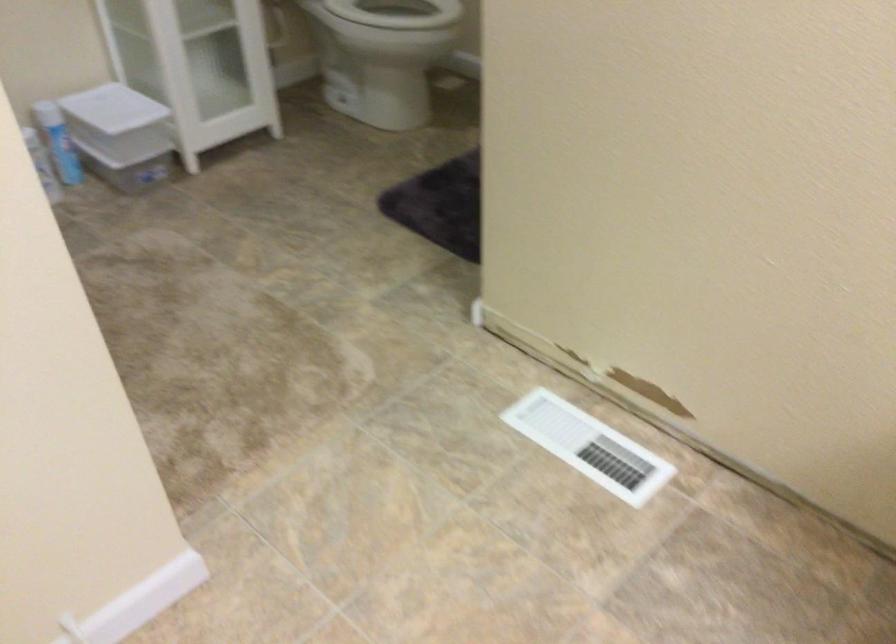
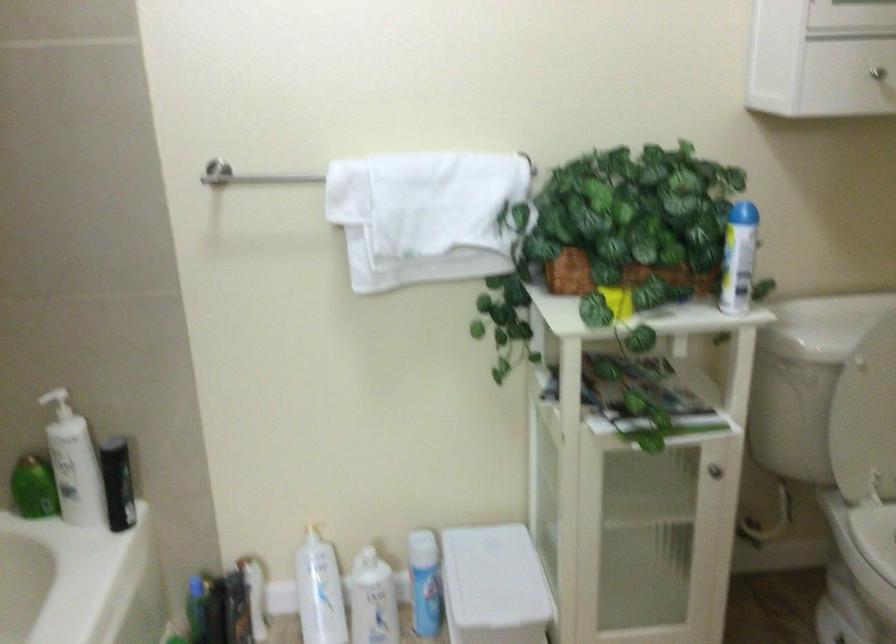
Locate, in the second image, the point that corresponds to (x=127, y=111) in the first image.

(493, 580)